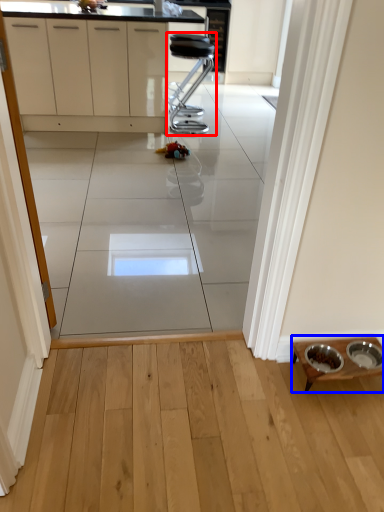
Question: Which object appears closest to the camera in this image, furniture (highlighted by a red box) or table (highlighted by a blue box)?

Choices:
 (A) furniture
 (B) table

Answer: (B)